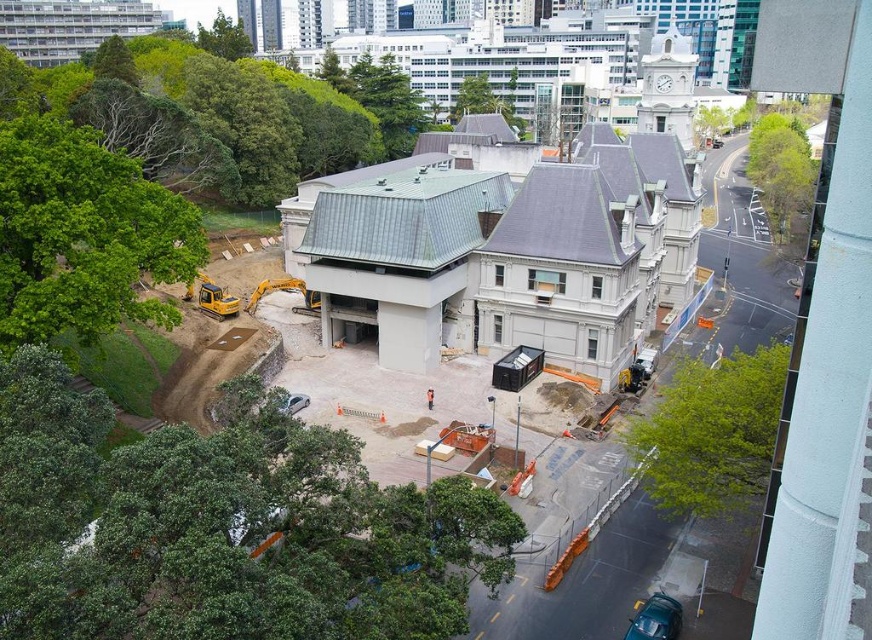
Question: Which point is closer to the camera?

Choices:
 (A) (31, 308)
 (B) (431, 390)

Answer: (A)

Question: Does green leafy tree at left appear under green leafy tree at upper right?

Choices:
 (A) no
 (B) yes

Answer: (B)

Question: Is green leafy tree at lower right smaller than orange safety vest at center?

Choices:
 (A) yes
 (B) no

Answer: (B)

Question: Which point appears closest to the camera in this image?

Choices:
 (A) (92, 560)
 (B) (771, 116)

Answer: (A)

Question: Is green leafy tree at lower left below green leafy tree at left?

Choices:
 (A) no
 (B) yes

Answer: (B)

Question: Which of the following is the closest to the observer?

Choices:
 (A) green leafy tree at center
 (B) green leafy tree at upper center
 (C) green leafy tree at lower left

Answer: (C)